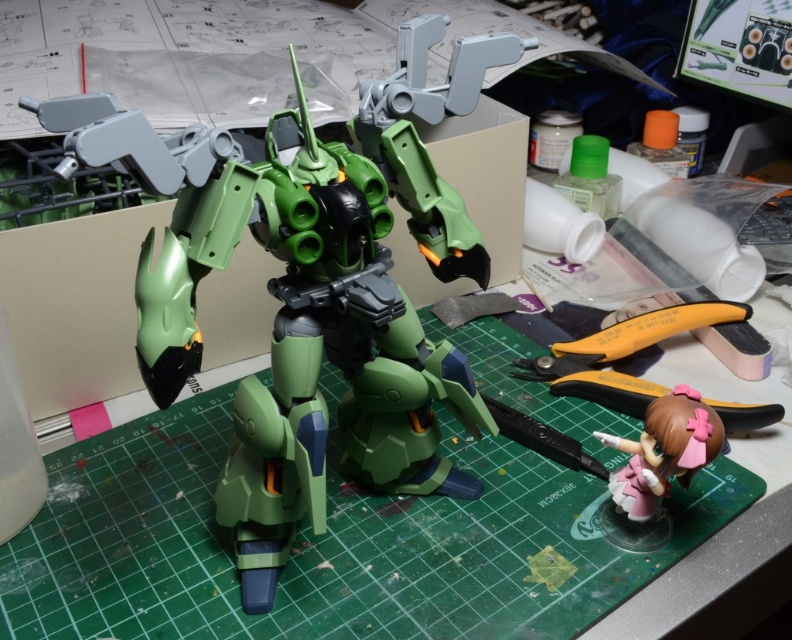
Is pink glossy figurine at lower right shorter than black plastic pliers at lower right?

No.

Does pink glossy figurine at lower right appear on the right side of black plastic pliers at lower right?

Indeed, pink glossy figurine at lower right is positioned on the right side of black plastic pliers at lower right.

What are the coordinates of `pink glossy figurine at lower right` in the screenshot? It's located at (663, 451).

Which is behind, point (711, 305) or point (543, 426)?

Point (711, 305)

At what (x,y) coordinates should I click in order to perform the action: click on yellow plastic pliers at center. Please return your answer as a coordinate pair (x, y). The height and width of the screenshot is (640, 792). Looking at the image, I should click on (627, 337).

Identify the location of yellow plastic pliers at center. (627, 337).

Who is lower down, green plastic robot at center or yellow plastic pliers at center?

Positioned lower is yellow plastic pliers at center.

This screenshot has width=792, height=640. Find the location of `green plastic robot at center`. green plastic robot at center is located at coordinates (315, 324).

Image resolution: width=792 pixels, height=640 pixels. In order to click on green plastic robot at center in this screenshot , I will do `click(315, 324)`.

What are the coordinates of `green plastic robot at center` in the screenshot? It's located at (315, 324).